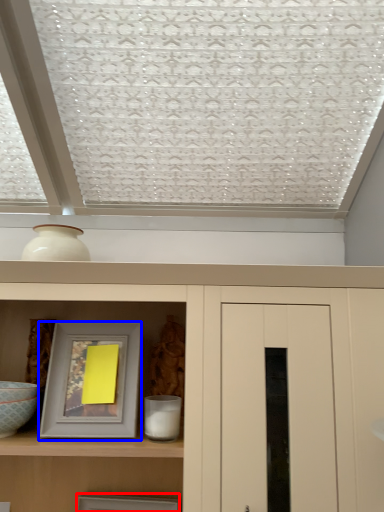
Question: Which point is closer to the camera, picture frame (highlighted by a red box) or picture frame (highlighted by a blue box)?

Choices:
 (A) picture frame
 (B) picture frame

Answer: (B)